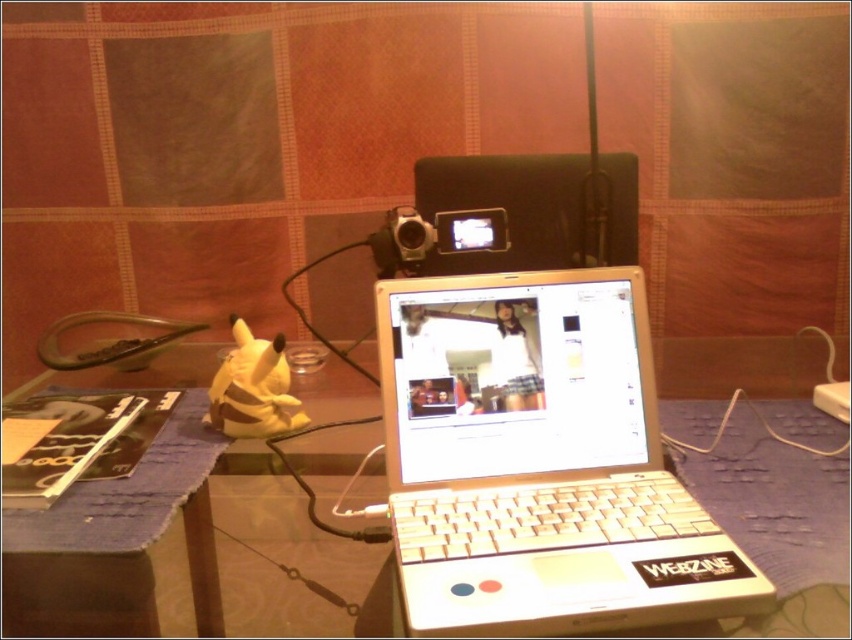
You are setting up a video call and need to place both the black matte speaker at upper center and the sleek black video camera at center on the table. Considering their sizes, which one should you place first to ensure they both fit comfortably?

The black matte speaker at upper center is larger in size than the sleek black video camera at center, so you should place the black matte speaker at upper center first to accommodate its larger size before positioning the sleek black video camera at center.

You are looking at the workspace setup. There are two points marked on the table. One is at coordinate point (502, 515) and the other is at point (380, 237). Which point is closer to you?

Point (502, 515) is closer to the viewer than point (380, 237).